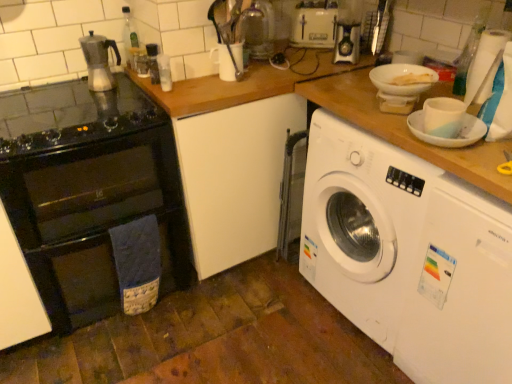
Locate an element on the screen. The image size is (512, 384). white paper at upper right is located at coordinates [485, 65].

What do you see at coordinates (408, 255) in the screenshot?
I see `white glossy washing machine at right, placed as the first washing machine when sorted from back to front` at bounding box center [408, 255].

In order to click on black glass oven at left in this screenshot , I will do `click(90, 193)`.

What do you see at coordinates (130, 37) in the screenshot?
I see `clear glass bottle at upper center, which is the fourth bottle from right to left` at bounding box center [130, 37].

At what (x,y) coordinates should I click in order to perform the action: click on black glass gas stove at left. Please return your answer as a coordinate pair (x, y). The image size is (512, 384). Looking at the image, I should click on (72, 116).

Measure the distance between white plastic toaster at upper center, which appears as the 1th appliance when viewed from the back, and camera.

white plastic toaster at upper center, which appears as the 1th appliance when viewed from the back, is 2.02 meters from camera.

Find the location of `white paper at upper right`. white paper at upper right is located at coordinates click(x=485, y=65).

Measure the distance between transparent glass bottle at center, acting as the 2th bottle starting from the right, and clear glass bottle at center, which is counted as the 2th bottle, starting from the left.

The distance of transparent glass bottle at center, acting as the 2th bottle starting from the right, from clear glass bottle at center, which is counted as the 2th bottle, starting from the left, is 1.80 inches.

From a real-world perspective, which is physically above, transparent glass bottle at center, acting as the 2th bottle starting from the right, or clear glass bottle at center, which is counted as the 2th bottle, starting from the left?

clear glass bottle at center, which is counted as the 2th bottle, starting from the left.

Is the surface of transparent glass bottle at center, the third bottle viewed from the left, in direct contact with clear glass bottle at center, arranged as the third bottle when viewed from the right?

Yes, transparent glass bottle at center, the third bottle viewed from the left, is beside clear glass bottle at center, arranged as the third bottle when viewed from the right.

What's the angular difference between black glass oven at left and black glass gas stove at left's facing directions?

The angular difference between black glass oven at left and black glass gas stove at left is 0.000124 degrees.

Considering the positions of objects black glass oven at left and black glass gas stove at left in the image provided, who is behind, black glass oven at left or black glass gas stove at left?

black glass oven at left.

Identify the location of oven located on the right of black glass gas stove at left. The image size is (512, 384). (90, 193).

From the image's perspective, between transparent plastic bottle at upper right, positioned as the 4th bottle in left-to-right order, and satin silver tea pot at upper left, who is located below?

From the image's view, transparent plastic bottle at upper right, positioned as the 4th bottle in left-to-right order, is below.

Can you tell me how much transparent plastic bottle at upper right, positioned as the 4th bottle in left-to-right order, and satin silver tea pot at upper left differ in facing direction?

They differ by 80.8 degrees in their facing directions.

Looking at this image, is transparent plastic bottle at upper right, positioned as the 4th bottle in left-to-right order, to the left or to the right of satin silver tea pot at upper left in the image?

Clearly, transparent plastic bottle at upper right, positioned as the 4th bottle in left-to-right order, is on the right of satin silver tea pot at upper left in the image.

Who is smaller, transparent plastic bottle at upper right, positioned as the 4th bottle in left-to-right order, or satin silver tea pot at upper left?

transparent plastic bottle at upper right, positioned as the 4th bottle in left-to-right order.

What's the angular difference between translucent glass kettle at upper center, the second appliance viewed from the front, and transparent glass bottle at center, acting as the 2th bottle starting from the right,'s facing directions?

There is a 1.08-degree angle between the facing directions of translucent glass kettle at upper center, the second appliance viewed from the front, and transparent glass bottle at center, acting as the 2th bottle starting from the right.

Is translucent glass kettle at upper center, the second appliance viewed from the front, positioned with its back to transparent glass bottle at center, acting as the 2th bottle starting from the right?

translucent glass kettle at upper center, the second appliance viewed from the front, does not have its back to transparent glass bottle at center, acting as the 2th bottle starting from the right.

Can you confirm if translucent glass kettle at upper center, which is counted as the second appliance, starting from the back, is bigger than transparent glass bottle at center, acting as the 2th bottle starting from the right?

Correct, translucent glass kettle at upper center, which is counted as the second appliance, starting from the back, is larger in size than transparent glass bottle at center, acting as the 2th bottle starting from the right.

Considering the sizes of objects translucent glass kettle at upper center, the second appliance viewed from the front, and transparent glass bottle at center, the third bottle viewed from the left, in the image provided, who is taller, translucent glass kettle at upper center, the second appliance viewed from the front, or transparent glass bottle at center, the third bottle viewed from the left,?

Standing taller between the two is translucent glass kettle at upper center, the second appliance viewed from the front.

Considering the relative positions of clear glass bottle at center, which is counted as the 2th bottle, starting from the left, and transparent plastic bottle at upper right, positioned as the 4th bottle in left-to-right order, in the image provided, is clear glass bottle at center, which is counted as the 2th bottle, starting from the left, to the left of transparent plastic bottle at upper right, positioned as the 4th bottle in left-to-right order, from the viewer's perspective?

Yes.

From the image's perspective, does clear glass bottle at center, which is counted as the 2th bottle, starting from the left, appear higher than transparent plastic bottle at upper right, which is counted as the 1th bottle, starting from the right?

Indeed, from the image's perspective, clear glass bottle at center, which is counted as the 2th bottle, starting from the left, is shown above transparent plastic bottle at upper right, which is counted as the 1th bottle, starting from the right.

Between clear glass bottle at center, which is counted as the 2th bottle, starting from the left, and transparent plastic bottle at upper right, which is counted as the 1th bottle, starting from the right, which one is positioned behind?

clear glass bottle at center, which is counted as the 2th bottle, starting from the left.

Choose the correct answer: Is clear glass bottle at center, which is counted as the 2th bottle, starting from the left, inside transparent plastic bottle at upper right, positioned as the 4th bottle in left-to-right order, or outside it?

clear glass bottle at center, which is counted as the 2th bottle, starting from the left, is not inside transparent plastic bottle at upper right, positioned as the 4th bottle in left-to-right order, it's outside.

Does white plastic toaster at upper center, placed as the 3th appliance when sorted from bottom to top, have a greater height compared to white glossy bowl at upper right?

Indeed, white plastic toaster at upper center, placed as the 3th appliance when sorted from bottom to top, has a greater height compared to white glossy bowl at upper right.

From the picture: From a real-world perspective, is white plastic toaster at upper center, acting as the 2th appliance starting from the left, under white glossy bowl at upper right?

Incorrect, from a real-world perspective, white plastic toaster at upper center, acting as the 2th appliance starting from the left, is higher than white glossy bowl at upper right.

Is white plastic toaster at upper center, which appears as the 1th appliance when viewed from the back, looking in the opposite direction of white glossy bowl at upper right?

No, white glossy bowl at upper right is not at the back of white plastic toaster at upper center, which appears as the 1th appliance when viewed from the back.

Looking at this image, who is taller, clear glass bottle at upper center, which is counted as the first bottle, starting from the left, or white glossy cup at upper right, placed as the third appliance when sorted from left to right?

clear glass bottle at upper center, which is counted as the first bottle, starting from the left, is taller.

From a real-world perspective, is clear glass bottle at upper center, which is the fourth bottle from right to left, on top of white glossy cup at upper right, which appears as the 1th appliance when viewed from the right?

Yes, from a real-world perspective, clear glass bottle at upper center, which is the fourth bottle from right to left, is on top of white glossy cup at upper right, which appears as the 1th appliance when viewed from the right.

Does point (123, 42) appear closer or farther from the camera than point (417, 123)?

Point (123, 42) is farther from the camera than point (417, 123).

Does clear glass bottle at upper center, which is counted as the first bottle, starting from the left, lie behind white glossy cup at upper right, placed as the third appliance when sorted from left to right?

Yes, clear glass bottle at upper center, which is counted as the first bottle, starting from the left, is further from the camera.

From the clear glass bottle at center, arranged as the third bottle when viewed from the right, count 1st bottle to the right and point to it. Please provide its 2D coordinates.

[(164, 72)]

At what (x,y) coordinates should I click in order to perform the action: click on oven behind the black glass gas stove at left. Please return your answer as a coordinate pair (x, y). Image resolution: width=512 pixels, height=384 pixels. Looking at the image, I should click on pos(90,193).

Based on their spatial positions, is white plastic toaster at upper center, placed as the 3th appliance when sorted from bottom to top, or white glossy bowl at upper right further from clear glass bottle at upper center, which is counted as the first bottle, starting from the left?

white glossy bowl at upper right.

When comparing their distances from white plastic toaster at upper center, placed as the 3th appliance when sorted from front to back, does white glossy bowl at upper right or white plastic washing machine at lower right, which is the 2th washing machine in back-to-front order, seem closer?

white glossy bowl at upper right lies closer to white plastic toaster at upper center, placed as the 3th appliance when sorted from front to back, than the other object.

Considering their positions, is black glass oven at left positioned further to transparent plastic bottle at upper right, which is counted as the 1th bottle, starting from the right, than transparent glass bottle at center, acting as the 2th bottle starting from the right?

Based on the image, black glass oven at left appears to be further to transparent plastic bottle at upper right, which is counted as the 1th bottle, starting from the right.

Based on their spatial positions, is white paper at upper right or white plastic washing machine at lower right, which is the 2th washing machine in back-to-front order, closer to white glossy cup at upper right, arranged as the 1th appliance when viewed from the front?

Based on the image, white paper at upper right appears to be nearer to white glossy cup at upper right, arranged as the 1th appliance when viewed from the front.

Based on their spatial positions, is clear glass bottle at center, arranged as the third bottle when viewed from the right, or black glass oven at left closer to white glossy washing machine at right, which is counted as the 2th washing machine, starting from the front?

black glass oven at left is closer to white glossy washing machine at right, which is counted as the 2th washing machine, starting from the front.

Looking at the image, which one is located further to transparent glass bottle at center, the third bottle viewed from the left, transparent plastic bottle at upper right, which is counted as the 1th bottle, starting from the right, or translucent glass kettle at upper center, which is the 2th appliance from top to bottom?

transparent plastic bottle at upper right, which is counted as the 1th bottle, starting from the right, is further to transparent glass bottle at center, the third bottle viewed from the left.

Based on their spatial positions, is satin silver tea pot at upper left or clear glass bottle at upper center, which is the fourth bottle from right to left, closer to white glossy cup at upper right, marked as the 3th appliance in a top-to-bottom arrangement?

Among the two, satin silver tea pot at upper left is located nearer to white glossy cup at upper right, marked as the 3th appliance in a top-to-bottom arrangement.

From the image, which object appears to be nearer to black glass gas stove at left, white paper at upper right or translucent glass kettle at upper center, the first appliance from the left?

translucent glass kettle at upper center, the first appliance from the left, lies closer to black glass gas stove at left than the other object.

This screenshot has width=512, height=384. What are the coordinates of `paper towel positioned between white glossy cup at upper right, which appears as the 1th appliance when viewed from the right, and transparent plastic bottle at upper right, which is counted as the 1th bottle, starting from the right, from near to far` in the screenshot? It's located at (485, 65).

The width and height of the screenshot is (512, 384). I want to click on basin between clear glass bottle at upper center, which is the fourth bottle from right to left, and white glossy cup at upper right, marked as the 3th appliance in a top-to-bottom arrangement, so (x=403, y=79).

Locate an element on the screen. basin between clear glass bottle at upper center, which is counted as the first bottle, starting from the left, and white paper at upper right, in the horizontal direction is located at coordinates (403, 79).

This screenshot has width=512, height=384. I want to click on tea pot between black glass oven at left and white glossy cup at upper right, marked as the 3th appliance in a top-to-bottom arrangement, so click(99, 61).